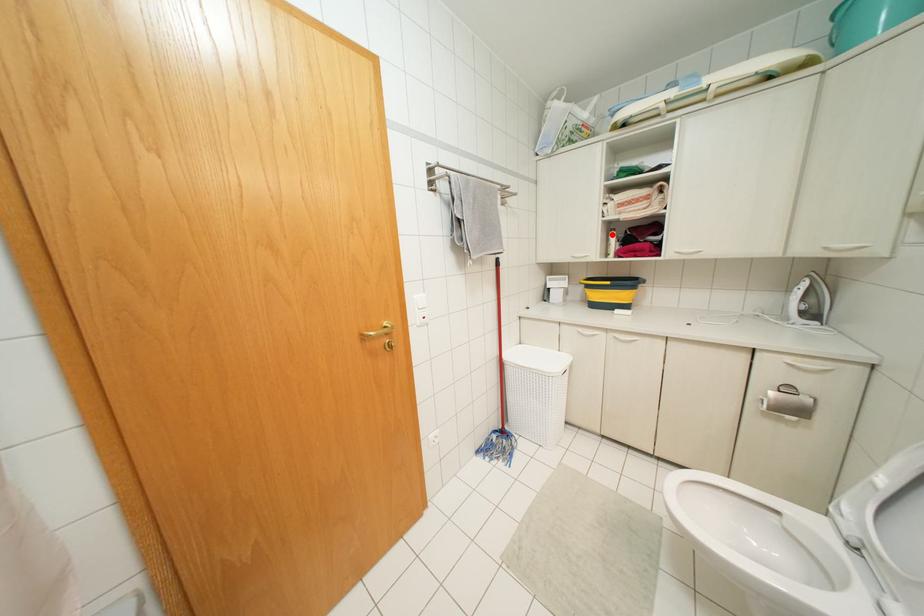
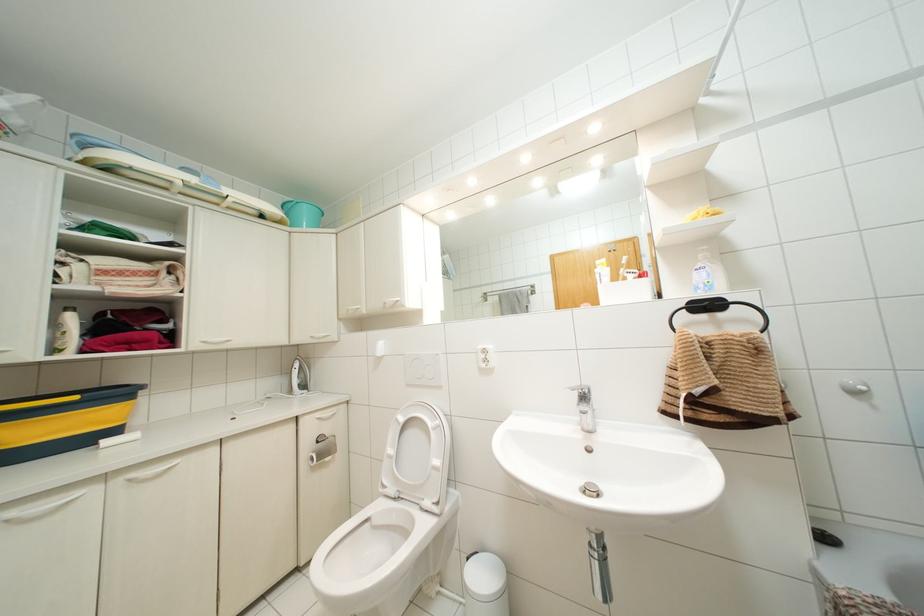
Where in the second image is the point corresponding to the highlighted location from the first image?

(70, 317)